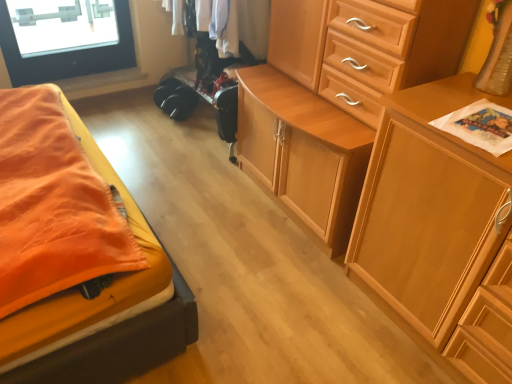
Where is `black fabric clothing at center`? The height and width of the screenshot is (384, 512). black fabric clothing at center is located at coordinates (219, 42).

Can you tell me how much black fabric clothing at center and wooden cabinet at center, positioned as the 2th chest of drawers in right-to-left order, differ in facing direction?

black fabric clothing at center and wooden cabinet at center, positioned as the 2th chest of drawers in right-to-left order, are facing 0.374 degrees away from each other.

Consider the image. From the image's perspective, is black fabric clothing at center over wooden cabinet at center, positioned as the 2th chest of drawers in right-to-left order?

Correct, black fabric clothing at center appears higher than wooden cabinet at center, positioned as the 2th chest of drawers in right-to-left order, in the image.

Which object is closer to the camera, black fabric clothing at center or wooden cabinet at center, acting as the 1th chest of drawers starting from the left?

wooden cabinet at center, acting as the 1th chest of drawers starting from the left, is more forward.

Is black fabric clothing at center oriented towards wooden cabinet at center, which appears as the first chest of drawers when viewed from the right?

No, black fabric clothing at center is not aimed at wooden cabinet at center, which appears as the first chest of drawers when viewed from the right.

Is black fabric clothing at center completely or partially outside of wooden cabinet at center, arranged as the 2th chest of drawers when viewed from the left?

black fabric clothing at center is positioned outside wooden cabinet at center, arranged as the 2th chest of drawers when viewed from the left.

Would you consider black fabric clothing at center to be distant from wooden cabinet at center, arranged as the 2th chest of drawers when viewed from the left?

Indeed, black fabric clothing at center is not near wooden cabinet at center, arranged as the 2th chest of drawers when viewed from the left.

How different are the orientations of wooden cabinet at center, which appears as the first chest of drawers when viewed from the right, and wooden cabinet at center, positioned as the 2th chest of drawers in right-to-left order, in degrees?

1.05 degrees separate the facing orientations of wooden cabinet at center, which appears as the first chest of drawers when viewed from the right, and wooden cabinet at center, positioned as the 2th chest of drawers in right-to-left order.

From the image's perspective, between wooden cabinet at center, arranged as the 2th chest of drawers when viewed from the left, and wooden cabinet at center, acting as the 1th chest of drawers starting from the left, who is located below?

wooden cabinet at center, arranged as the 2th chest of drawers when viewed from the left.

Between point (435, 109) and point (243, 88), which one is positioned in front?

Point (435, 109)

From a real-world perspective, is wooden cabinet at center, arranged as the 2th chest of drawers when viewed from the left, located beneath wooden cabinet at center, positioned as the 2th chest of drawers in right-to-left order?

Correct, in the physical world, wooden cabinet at center, arranged as the 2th chest of drawers when viewed from the left, is lower than wooden cabinet at center, positioned as the 2th chest of drawers in right-to-left order.

From a real-world perspective, is wooden cabinet at center, acting as the 1th chest of drawers starting from the left, below wooden cabinet at center, which appears as the first chest of drawers when viewed from the right?

No, from a real-world perspective, wooden cabinet at center, acting as the 1th chest of drawers starting from the left, is not under wooden cabinet at center, which appears as the first chest of drawers when viewed from the right.

Is wooden cabinet at center, acting as the 1th chest of drawers starting from the left, next to wooden cabinet at center, which appears as the first chest of drawers when viewed from the right, and touching it?

No, wooden cabinet at center, acting as the 1th chest of drawers starting from the left, is not in contact with wooden cabinet at center, which appears as the first chest of drawers when viewed from the right.

From the picture: Between wooden cabinet at center, positioned as the 2th chest of drawers in right-to-left order, and wooden cabinet at center, which appears as the first chest of drawers when viewed from the right, which one has larger size?

Bigger between the two is wooden cabinet at center, positioned as the 2th chest of drawers in right-to-left order.

In the image, is wooden cabinet at center, positioned as the 2th chest of drawers in right-to-left order, positioned in front of or behind wooden cabinet at center, arranged as the 2th chest of drawers when viewed from the left?

In the image, wooden cabinet at center, positioned as the 2th chest of drawers in right-to-left order, appears behind wooden cabinet at center, arranged as the 2th chest of drawers when viewed from the left.

Which of these two, wooden cabinet at center, acting as the 1th chest of drawers starting from the left, or black fabric clothing at center, is bigger?

wooden cabinet at center, acting as the 1th chest of drawers starting from the left, is bigger.

Starting from the black fabric clothing at center, which chest of drawers is the 1st one to the right? Please provide its 2D coordinates.

[(336, 97)]

From a real-world perspective, is wooden cabinet at center, acting as the 1th chest of drawers starting from the left, positioned above or below black fabric clothing at center?

In terms of real-world spatial position, wooden cabinet at center, acting as the 1th chest of drawers starting from the left, is below black fabric clothing at center.

Can you confirm if wooden cabinet at center, positioned as the 2th chest of drawers in right-to-left order, is wider than black fabric clothing at center?

Indeed, wooden cabinet at center, positioned as the 2th chest of drawers in right-to-left order, has a greater width compared to black fabric clothing at center.

Considering the sizes of objects wooden cabinet at center, arranged as the 2th chest of drawers when viewed from the left, and black fabric clothing at center in the image provided, who is shorter, wooden cabinet at center, arranged as the 2th chest of drawers when viewed from the left, or black fabric clothing at center?

With less height is black fabric clothing at center.

Which is nearer, (x=429, y=96) or (x=253, y=63)?

Point (x=429, y=96) is positioned closer to the camera compared to point (x=253, y=63).

Which of these two, wooden cabinet at center, which appears as the first chest of drawers when viewed from the right, or black fabric clothing at center, is wider?

With larger width is wooden cabinet at center, which appears as the first chest of drawers when viewed from the right.

Which object is positioned more to the left, wooden cabinet at center, which appears as the first chest of drawers when viewed from the right, or black fabric clothing at center?

black fabric clothing at center.

This screenshot has width=512, height=384. There is a black fabric clothing at center. In order to click on the 1st chest of drawers below it (from the image's perspective) in this screenshot , I will do `click(336, 97)`.

From a real-world perspective, starting from the black fabric clothing at center, which chest of drawers is the 2nd one below it? Please provide its 2D coordinates.

[(428, 214)]

From the image, which object appears to be farther from wooden cabinet at center, acting as the 1th chest of drawers starting from the left, wooden cabinet at center, arranged as the 2th chest of drawers when viewed from the left, or black fabric clothing at center?

black fabric clothing at center is positioned further to the anchor wooden cabinet at center, acting as the 1th chest of drawers starting from the left.

When comparing their distances from wooden cabinet at center, arranged as the 2th chest of drawers when viewed from the left, does black fabric clothing at center or wooden cabinet at center, positioned as the 2th chest of drawers in right-to-left order, seem closer?

wooden cabinet at center, positioned as the 2th chest of drawers in right-to-left order, lies closer to wooden cabinet at center, arranged as the 2th chest of drawers when viewed from the left, than the other object.

Consider the image. Estimate the real-world distances between objects in this image. Which object is closer to wooden cabinet at center, acting as the 1th chest of drawers starting from the left, black fabric clothing at center or wooden cabinet at center, which appears as the first chest of drawers when viewed from the right?

The object closer to wooden cabinet at center, acting as the 1th chest of drawers starting from the left, is wooden cabinet at center, which appears as the first chest of drawers when viewed from the right.

Which object lies nearer to the anchor point black fabric clothing at center, wooden cabinet at center, positioned as the 2th chest of drawers in right-to-left order, or wooden cabinet at center, which appears as the first chest of drawers when viewed from the right?

wooden cabinet at center, positioned as the 2th chest of drawers in right-to-left order, lies closer to black fabric clothing at center than the other object.

From the image, which object appears to be farther from black fabric clothing at center, wooden cabinet at center, which appears as the first chest of drawers when viewed from the right, or wooden cabinet at center, positioned as the 2th chest of drawers in right-to-left order?

wooden cabinet at center, which appears as the first chest of drawers when viewed from the right, is positioned further to the anchor black fabric clothing at center.

Based on their spatial positions, is wooden cabinet at center, positioned as the 2th chest of drawers in right-to-left order, or black fabric clothing at center closer to wooden cabinet at center, arranged as the 2th chest of drawers when viewed from the left?

Based on the image, wooden cabinet at center, positioned as the 2th chest of drawers in right-to-left order, appears to be nearer to wooden cabinet at center, arranged as the 2th chest of drawers when viewed from the left.

Identify the location of chest of drawers between wooden cabinet at center, which appears as the first chest of drawers when viewed from the right, and black fabric clothing at center from front to back. The height and width of the screenshot is (384, 512). (336, 97).